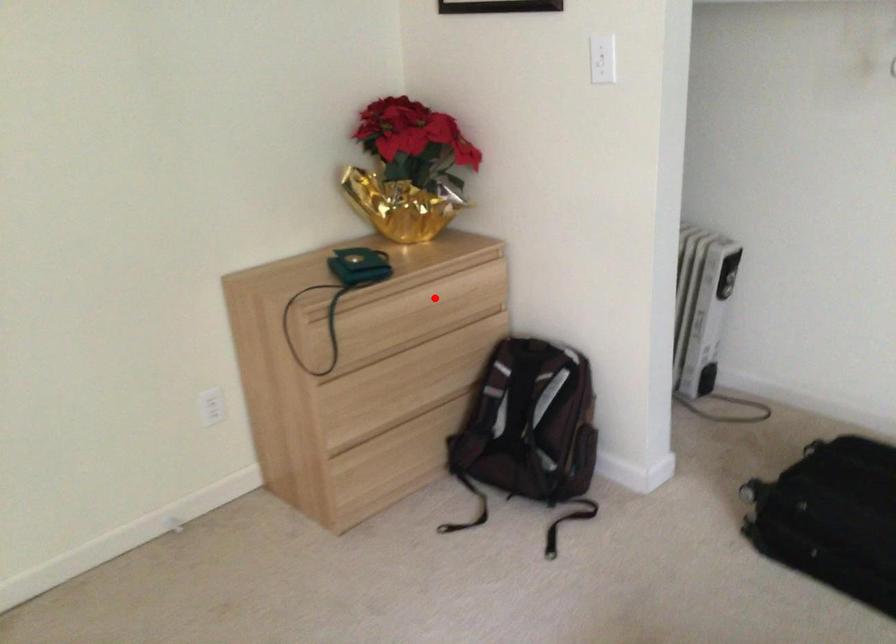
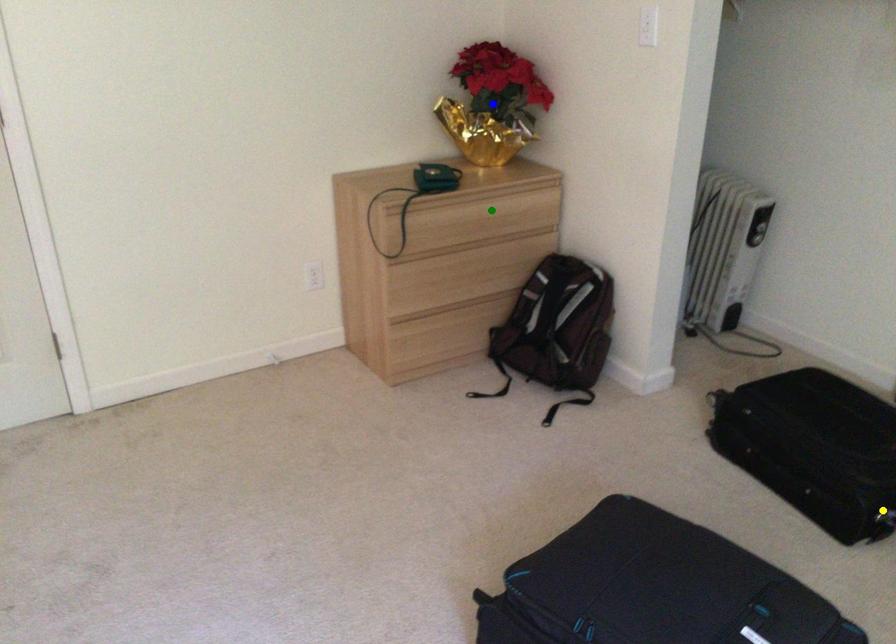
Question: I am providing you with two images of the same scene from different viewpoints. A red point is marked on the first image. You are given multiple points on the second image. Which point in image 2 is actually the same real-world point as the red point in image 1?

Choices:
 (A) green point
 (B) yellow point
 (C) blue point

Answer: (A)